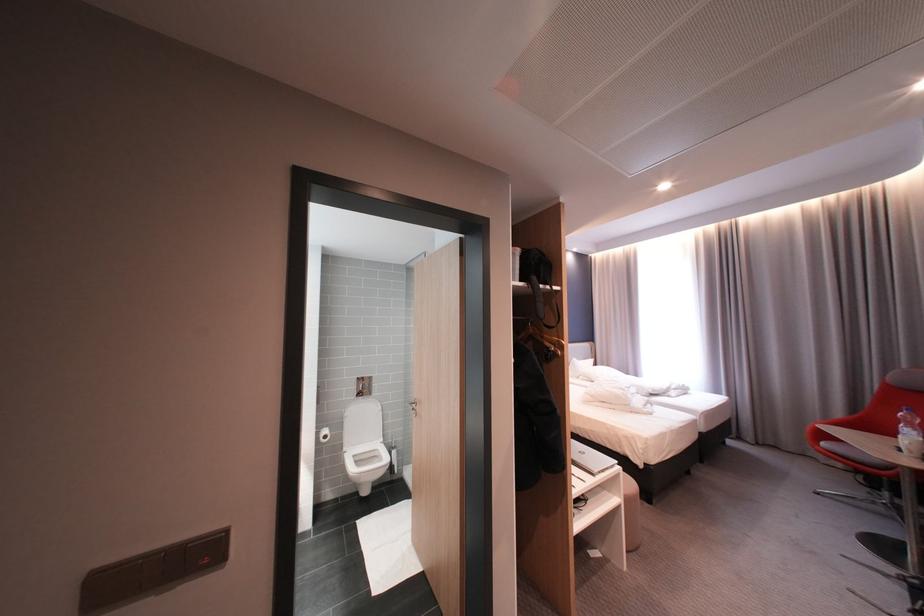
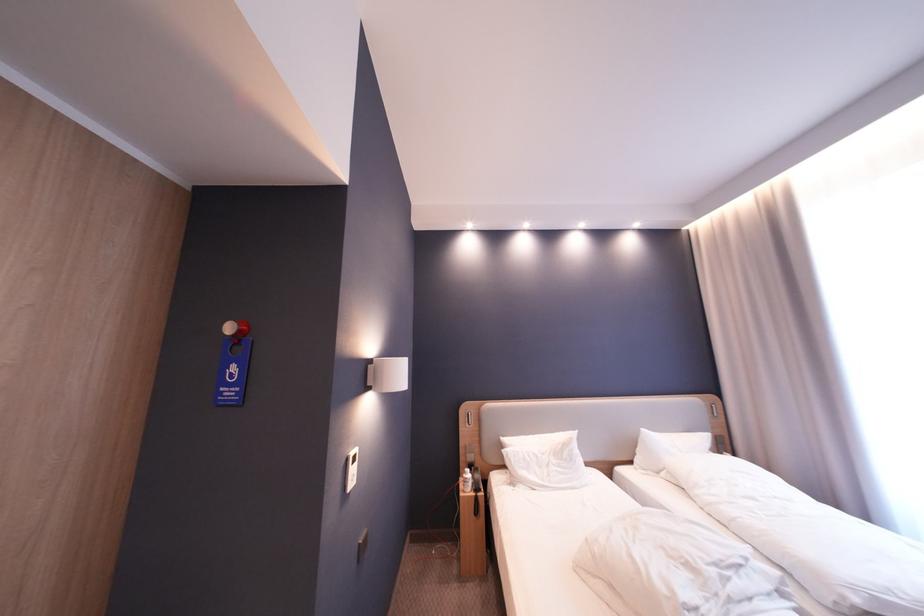
The images are taken continuously from a first-person perspective. In which direction are you moving?

The movement direction of the cameraman is right, forward.